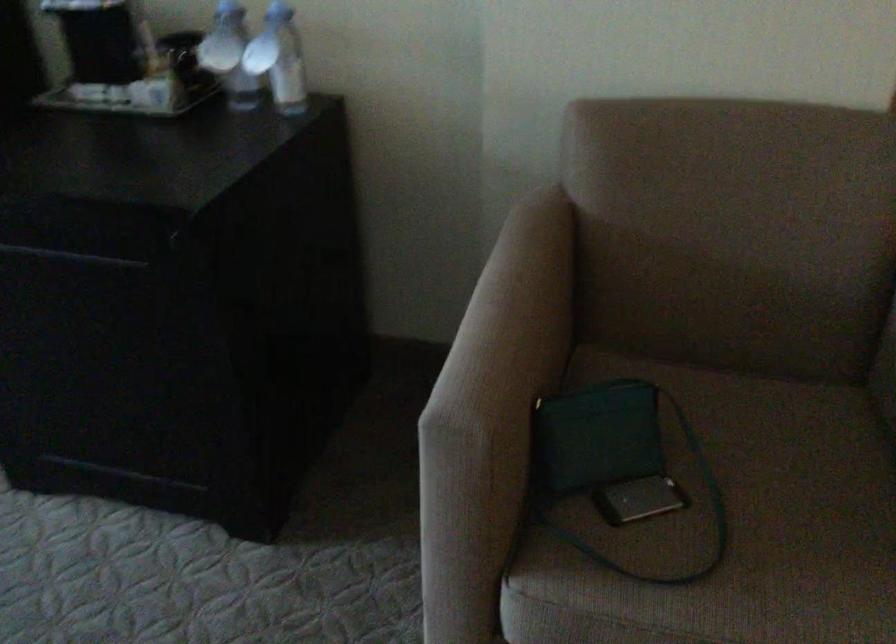
What do you see at coordinates (729, 526) in the screenshot? I see `the chair sitting surface` at bounding box center [729, 526].